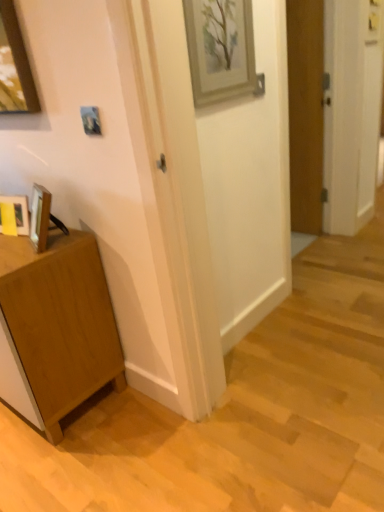
Question: Is light brown wood cabinet at lower left spatially inside matte wooden picture frame at lower left, the 3th picture frame in the right-to-left sequence, or outside of it?

Choices:
 (A) inside
 (B) outside

Answer: (B)

Question: Considering the positions of light brown wood cabinet at lower left and matte wooden picture frame at lower left, the first picture frame in the left-to-right sequence, in the image, is light brown wood cabinet at lower left taller or shorter than matte wooden picture frame at lower left, the first picture frame in the left-to-right sequence,?

Choices:
 (A) tall
 (B) short

Answer: (A)

Question: Estimate the real-world distances between objects in this image. Which object is farther from the light brown wood cabinet at lower left?

Choices:
 (A) metallic silver picture frame at upper center, which ranks as the second picture frame in left-to-right order
 (B) wooden framed picture at upper center, positioned as the third picture frame in bottom-to-top order
 (C) matte wooden picture frame at lower left, the first picture frame in the left-to-right sequence
 (D) wooden door at right

Answer: (D)

Question: Which of these objects is positioned farthest from the wooden framed picture at upper center, positioned as the 3th picture frame in left-to-right order?

Choices:
 (A) wooden door at right
 (B) metallic silver picture frame at upper center, the second picture frame when ordered from top to bottom
 (C) light brown wood cabinet at lower left
 (D) matte wooden picture frame at lower left, which ranks as the first picture frame in bottom-to-top order

Answer: (A)